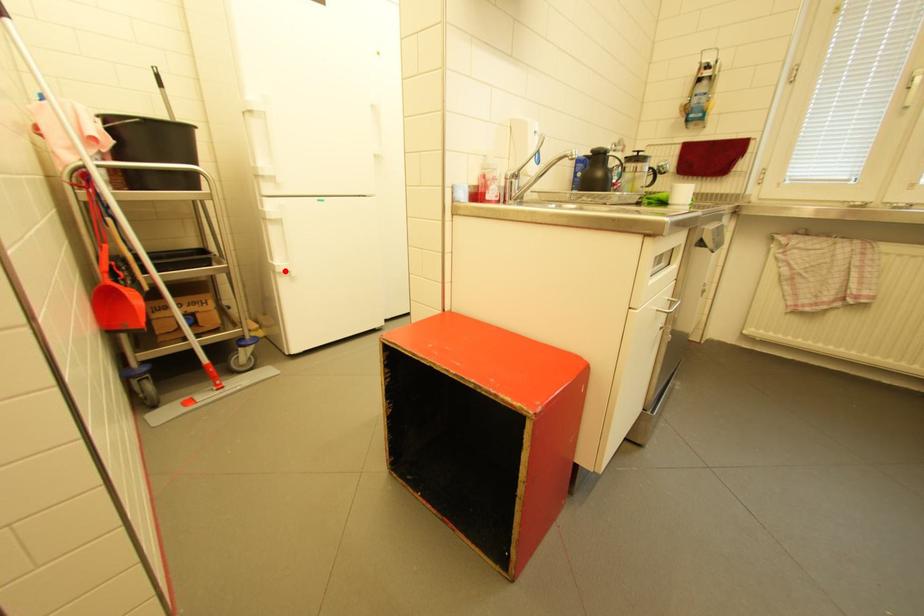
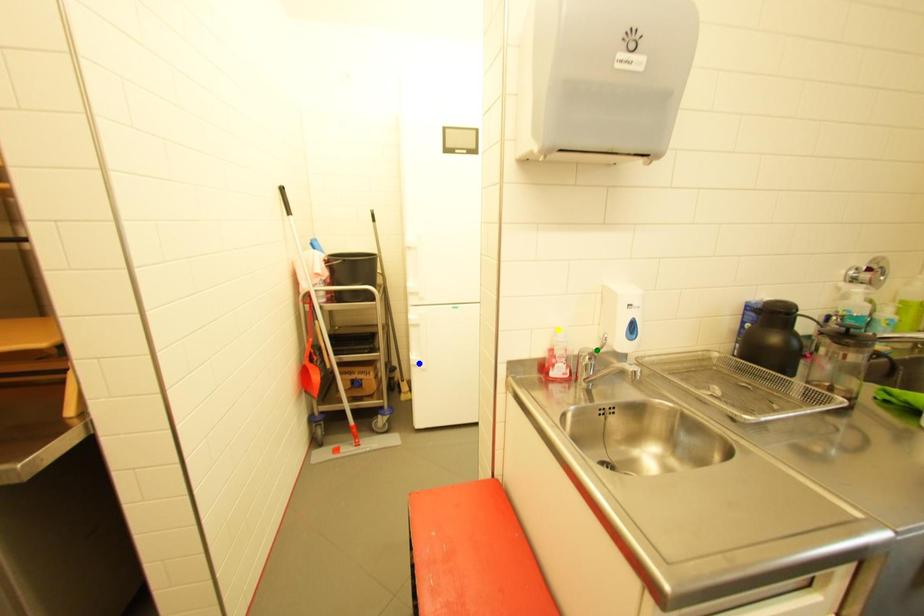
Question: I am providing you with two images of the same scene from different viewpoints. A red point is marked on the first image. You are given multiple points on the second image. Which point in image 2 is actually the same real-world point as the red point in image 1?

Choices:
 (A) yellow point
 (B) green point
 (C) blue point

Answer: (C)